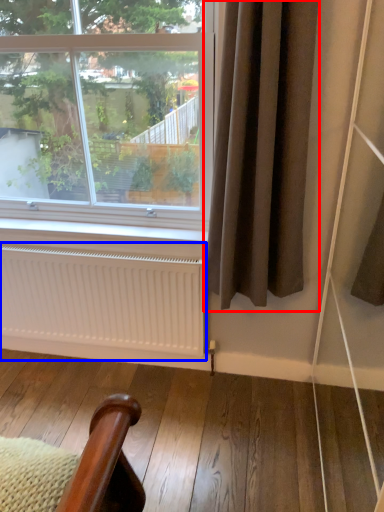
Question: Which point is further to the camera, curtain (highlighted by a red box) or radiator (highlighted by a blue box)?

Choices:
 (A) curtain
 (B) radiator

Answer: (B)